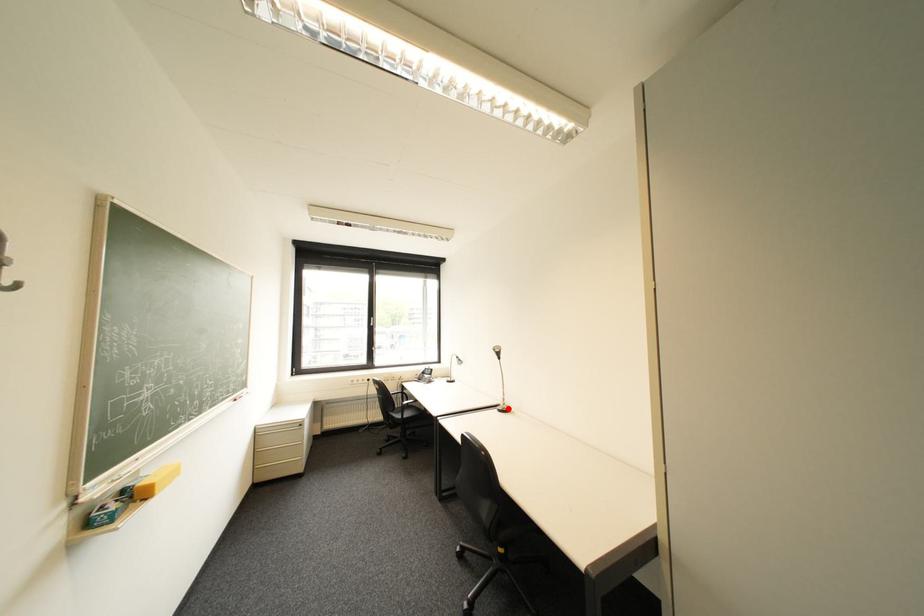
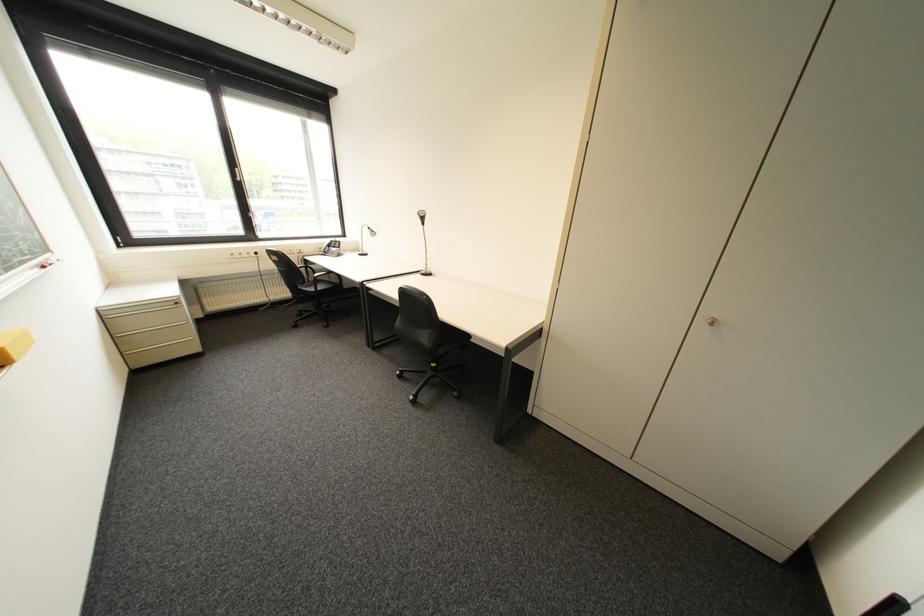
Question: A red point is marked in image1. In image2, is the corresponding 3D point closer to the camera or farther? Reply with the corresponding letter.

Choices:
 (A) The corresponding 3D point is closer.
 (B) The corresponding 3D point is farther.

Answer: (A)